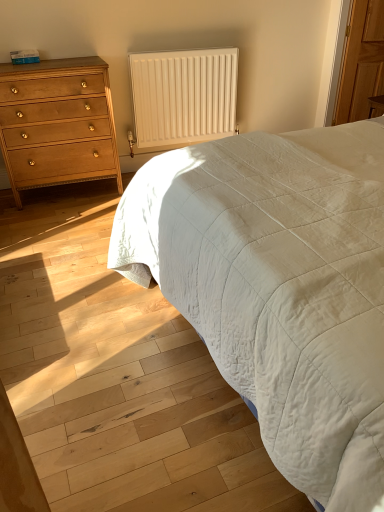
Question: Does matte wood chest of drawers at left turn towards white quilted fabric at center?

Choices:
 (A) yes
 (B) no

Answer: (B)

Question: Would you say matte wood chest of drawers at left is outside white quilted fabric at center?

Choices:
 (A) no
 (B) yes

Answer: (B)

Question: From a real-world perspective, is matte wood chest of drawers at left physically above white quilted fabric at center?

Choices:
 (A) no
 (B) yes

Answer: (B)

Question: Is matte wood chest of drawers at left positioned with its back to white quilted fabric at center?

Choices:
 (A) yes
 (B) no

Answer: (B)

Question: Is matte wood chest of drawers at left further to camera compared to white quilted fabric at center?

Choices:
 (A) no
 (B) yes

Answer: (B)

Question: Looking at their shapes, would you say white matte radiator at upper center is wider or thinner than matte wood chest of drawers at left?

Choices:
 (A) thin
 (B) wide

Answer: (A)

Question: Would you say white matte radiator at upper center is to the left or to the right of matte wood chest of drawers at left in the picture?

Choices:
 (A) left
 (B) right

Answer: (B)

Question: Considering the positions of point (185, 61) and point (99, 87), is point (185, 61) closer or farther from the camera than point (99, 87)?

Choices:
 (A) closer
 (B) farther

Answer: (B)

Question: Is white matte radiator at upper center inside or outside of matte wood chest of drawers at left?

Choices:
 (A) outside
 (B) inside

Answer: (A)

Question: From a real-world perspective, is matte wood chest of drawers at left positioned above or below white quilted fabric at center?

Choices:
 (A) below
 (B) above

Answer: (B)

Question: Which is correct: matte wood chest of drawers at left is inside white quilted fabric at center, or outside of it?

Choices:
 (A) outside
 (B) inside

Answer: (A)

Question: Is matte wood chest of drawers at left bigger or smaller than white quilted fabric at center?

Choices:
 (A) small
 (B) big

Answer: (A)

Question: In terms of width, does matte wood chest of drawers at left look wider or thinner when compared to white quilted fabric at center?

Choices:
 (A) wide
 (B) thin

Answer: (B)

Question: From a real-world perspective, is matte wood chest of drawers at left physically located above or below white matte radiator at upper center?

Choices:
 (A) above
 (B) below

Answer: (B)

Question: Based on their positions, is matte wood chest of drawers at left located to the left or right of white matte radiator at upper center?

Choices:
 (A) right
 (B) left

Answer: (B)